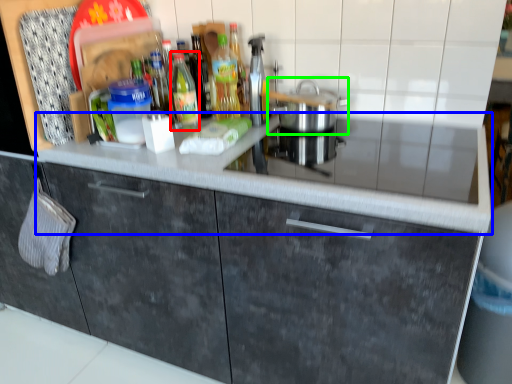
Question: Estimate the real-world distances between objects in this image. Which object is farther from bottle (highlighted by a red box), countertop (highlighted by a blue box) or home appliance (highlighted by a green box)?

Choices:
 (A) countertop
 (B) home appliance

Answer: (A)